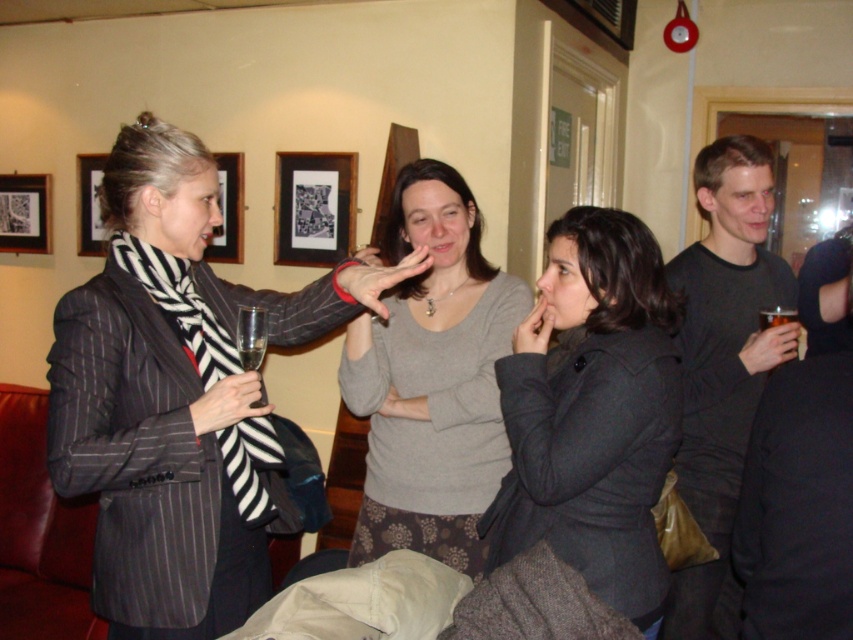
Question: Among these points, which one is farthest from the camera?

Choices:
 (A) [x=241, y=356]
 (B) [x=32, y=214]

Answer: (B)

Question: Which object is farther from the camera taking this photo?

Choices:
 (A) translucent glass at upper right
 (B) gray sweater at center
 (C) dark gray wool coat at center
 (D) black matte shirt at right

Answer: (A)

Question: Which object is farther from the camera taking this photo?

Choices:
 (A) dark gray wool coat at center
 (B) translucent glass at center
 (C) matte black picture frame at upper left
 (D) translucent glass at upper right

Answer: (C)

Question: Does dark gray wool coat at center appear under translucent glass at upper right?

Choices:
 (A) yes
 (B) no

Answer: (A)

Question: Can you confirm if gray sweater at center is positioned above translucent glass at upper right?

Choices:
 (A) yes
 (B) no

Answer: (B)

Question: Can you confirm if striped fabric scarf at left is wider than black matte shirt at right?

Choices:
 (A) no
 (B) yes

Answer: (B)